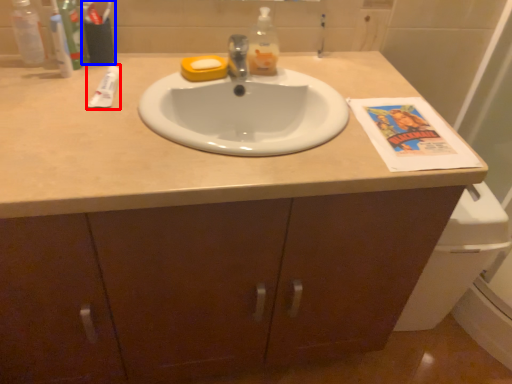
Question: Among these objects, which one is nearest to the camera, toothpaste (highlighted by a red box) or toiletry (highlighted by a blue box)?

Choices:
 (A) toothpaste
 (B) toiletry

Answer: (A)